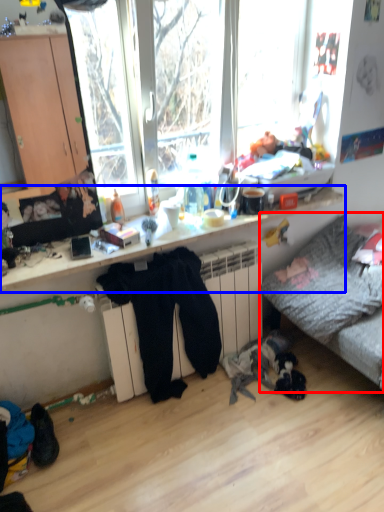
Question: Which object is further to the camera taking this photo, studio couch (highlighted by a red box) or desk (highlighted by a blue box)?

Choices:
 (A) studio couch
 (B) desk

Answer: (A)